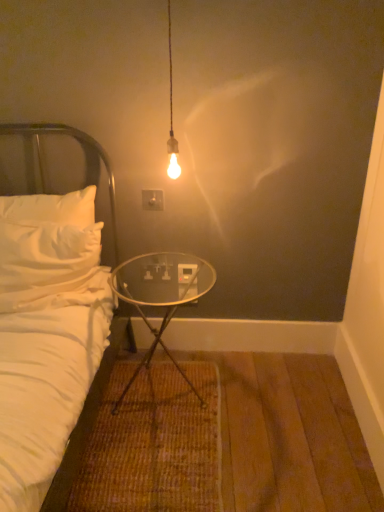
Find the location of a particular element. vacant space to the right of transparent glass table at center is located at coordinates (251, 401).